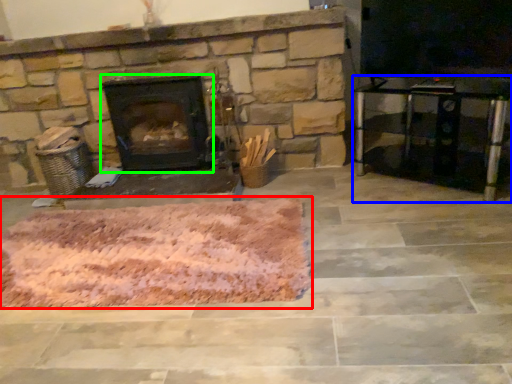
Question: Which is farther away from mat (highlighted by a red box)? entertainment center (highlighted by a blue box) or wood burning stove (highlighted by a green box)?

Choices:
 (A) entertainment center
 (B) wood burning stove

Answer: (A)